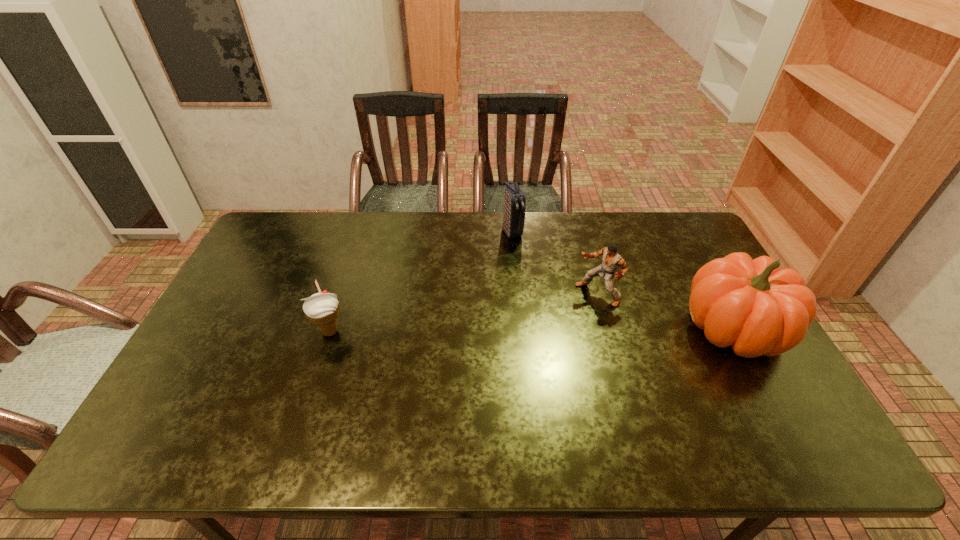
Image resolution: width=960 pixels, height=540 pixels. In order to click on free space located 0.230m with the zip open on the clutch bag in this screenshot , I will do `click(544, 284)`.

This screenshot has width=960, height=540. In order to click on vacant space located 0.380m on the front-facing side of the third object from left to right in this screenshot , I will do `click(481, 363)`.

What are the coordinates of `free space located 0.290m on the front-facing side of the third object from left to right` in the screenshot? It's located at (508, 348).

At what (x,y) coordinates should I click in order to perform the action: click on vacant space situated on the front-facing side of the third object from left to right. Please return your answer as a coordinate pair (x, y). The height and width of the screenshot is (540, 960). Looking at the image, I should click on (499, 353).

Locate an element on the screen. The height and width of the screenshot is (540, 960). object present at the far edge is located at coordinates (514, 199).

At what (x,y) coordinates should I click in order to perform the action: click on object that is at the right edge. Please return your answer as a coordinate pair (x, y). The height and width of the screenshot is (540, 960). Looking at the image, I should click on click(751, 305).

In the image, there is a desktop. What are the coordinates of `vacant area at the far edge` in the screenshot? It's located at (553, 213).

The width and height of the screenshot is (960, 540). I want to click on vacant area at the near edge, so click(481, 409).

Locate an element on the screen. This screenshot has width=960, height=540. free space at the left edge of the desktop is located at coordinates [219, 369].

Identify the location of vacant space at the right edge of the desktop. This screenshot has height=540, width=960. (684, 255).